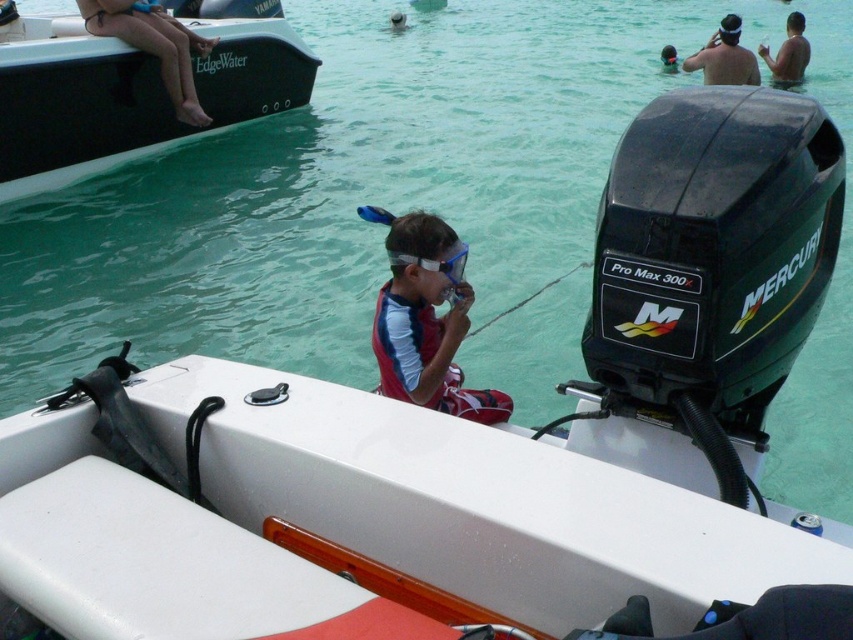
You are a safety inspector checking the equipment on the waterfront. You notice the black rubber boat at upper left and the clear plastic goggles at center. Which object is taller?

The black rubber boat at upper left is much taller than the clear plastic goggles at center.

You are a photographer trying to capture a clear shot of both the black rubber boat at upper left and the smooth skin headband at upper right. Since you want both objects to be fully visible in your photo, which object should you focus on first to ensure depth of field?

The black rubber boat at upper left has a greater height compared to the smooth skin headband at upper right, so focusing on the taller object first will help ensure both are in focus.

You are a photographer trying to capture a closeup shot of the tan skin legs at upper left and the smooth skin headband at upper right. Which object should you zoom in on to ensure it fills the frame without cropping?

The tan skin legs at upper left should be zoomed in on because it is wider than the smooth skin headband at upper right, so it requires more focus to fill the frame without cropping.